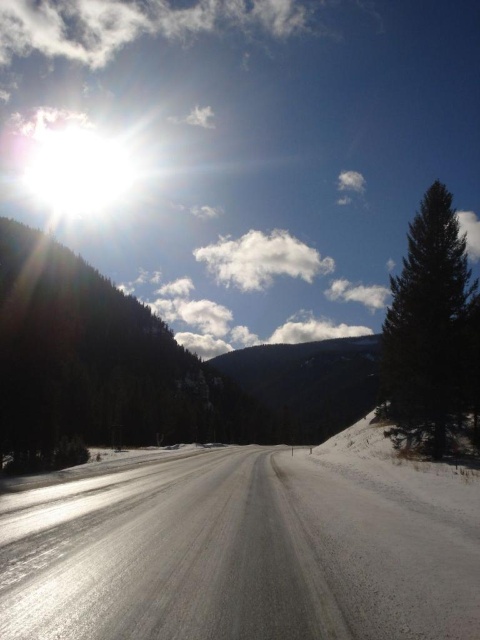
You are a hiker planning to walk along the white smooth road at center. You see the green textured pine tree at left in the distance. Which object is closer to you as you stand at the starting point of the road?

The white smooth road at center is closer to the viewer than the green textured pine tree at left, so the road is closer to you.

You are a hiker standing at the green textured pine tree at left and want to reach the white smooth road at center. Which direction should you walk to get there?

You should walk to the right because the white smooth road at center is located to the right of the green textured pine tree at left.

You are a hiker planning to cross the white smooth road at center and reach the dark green coniferous tree at right. Which direction should you walk to get from the road to the tree?

You should walk to the right side from the white smooth road at center to reach the dark green coniferous tree at right since the road is positioned on the left side of the tree.